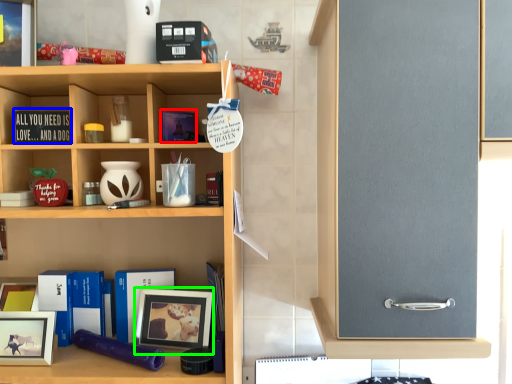
Question: Which is nearer to the book (highlighted by a red box)? book (highlighted by a blue box) or picture frame (highlighted by a green box).

Choices:
 (A) book
 (B) picture frame

Answer: (A)